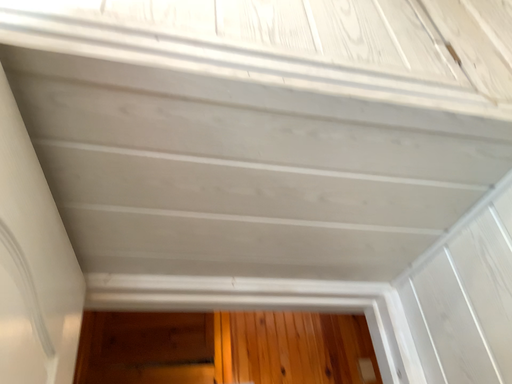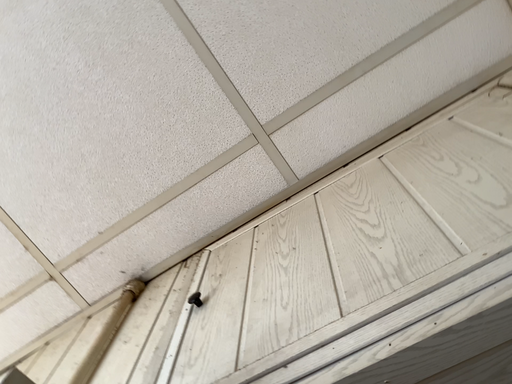
Question: Which way did the camera rotate in the video?

Choices:
 (A) rotated left
 (B) rotated right

Answer: (A)